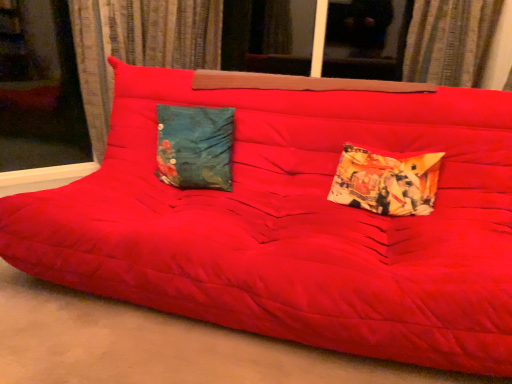
Question: Is teal fabric pillow at center, arranged as the first pillow when viewed from the left, wider or thinner than textured fabric curtain at upper center, which appears as the second curtain when viewed from the left?

Choices:
 (A) thin
 (B) wide

Answer: (A)

Question: Considering the positions of point (161, 117) and point (454, 1), is point (161, 117) closer or farther from the camera than point (454, 1)?

Choices:
 (A) closer
 (B) farther

Answer: (A)

Question: Based on their relative distances, which object is farther from the velvet curtain at left, marked as the 1th curtain in a left-to-right arrangement?

Choices:
 (A) printed fabric pillow at right, positioned as the second pillow in left-to-right order
 (B) transparent glass window at upper left, which is the second window in right-to-left order
 (C) textured fabric curtain at upper center, the first curtain positioned from the right
 (D) transparent glass window at upper center, which is the 2th window in left-to-right order
 (E) teal fabric pillow at center, arranged as the first pillow when viewed from the left

Answer: (A)

Question: Which of these objects is positioned farthest from the printed fabric pillow at right, positioned as the 1th pillow in right-to-left order?

Choices:
 (A) velvet curtain at left, marked as the 1th curtain in a left-to-right arrangement
 (B) teal fabric pillow at center, acting as the second pillow starting from the right
 (C) transparent glass window at upper left, which is the second window in right-to-left order
 (D) textured fabric curtain at upper center, the first curtain positioned from the right
 (E) matte red futon at center

Answer: (C)